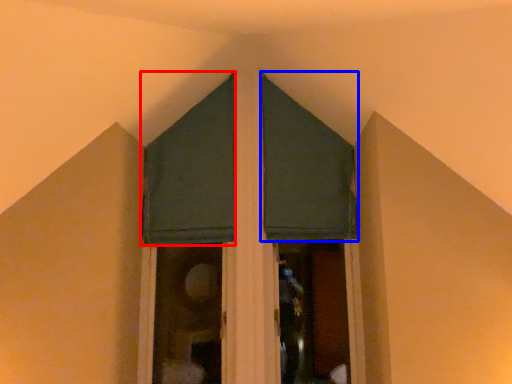
Question: Which object appears farthest to the camera in this image, curtain (highlighted by a red box) or curtain (highlighted by a blue box)?

Choices:
 (A) curtain
 (B) curtain

Answer: (B)